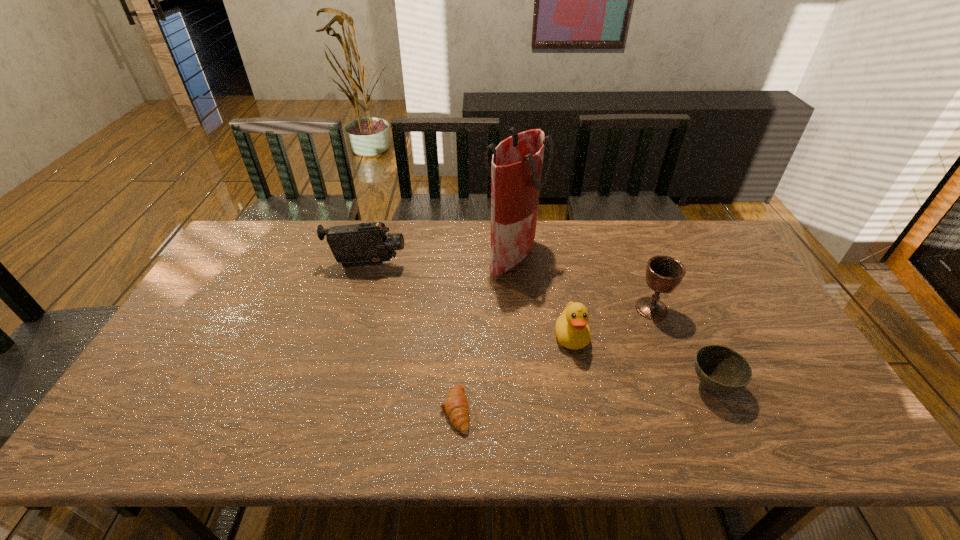
Locate an element on the screen. free space located at the beak of the fourth tallest object is located at coordinates (578, 370).

At what (x,y) coordinates should I click in order to perform the action: click on vacant space positioned 0.100m on the front of the second shortest object. Please return your answer as a coordinate pair (x, y). This screenshot has height=540, width=960. Looking at the image, I should click on (740, 447).

Locate an element on the screen. vacant area situated on the right of the crescent roll is located at coordinates (499, 409).

Where is `grocery bag at the far edge`? The image size is (960, 540). grocery bag at the far edge is located at coordinates (516, 170).

Locate an element on the screen. The image size is (960, 540). camcorder at the far edge is located at coordinates (363, 244).

Where is `object at the near edge`? The width and height of the screenshot is (960, 540). object at the near edge is located at coordinates [x=456, y=406].

Where is `blank space at the far edge`? blank space at the far edge is located at coordinates (444, 230).

Locate an element on the screen. The image size is (960, 540). vacant space at the near edge of the desktop is located at coordinates (688, 427).

Where is `free space at the left edge of the desktop`? Image resolution: width=960 pixels, height=540 pixels. free space at the left edge of the desktop is located at coordinates (197, 351).

This screenshot has height=540, width=960. In the image, there is a desktop. In order to click on vacant space at the right edge in this screenshot , I will do `click(739, 306)`.